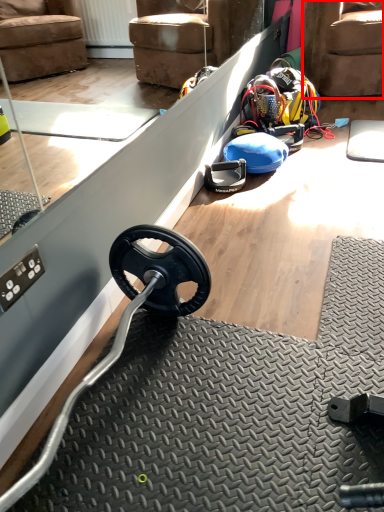
Question: Considering the relative positions of armchair (annotated by the red box) and wheel in the image provided, where is armchair (annotated by the red box) located with respect to the staircase?

Choices:
 (A) right
 (B) left

Answer: (A)